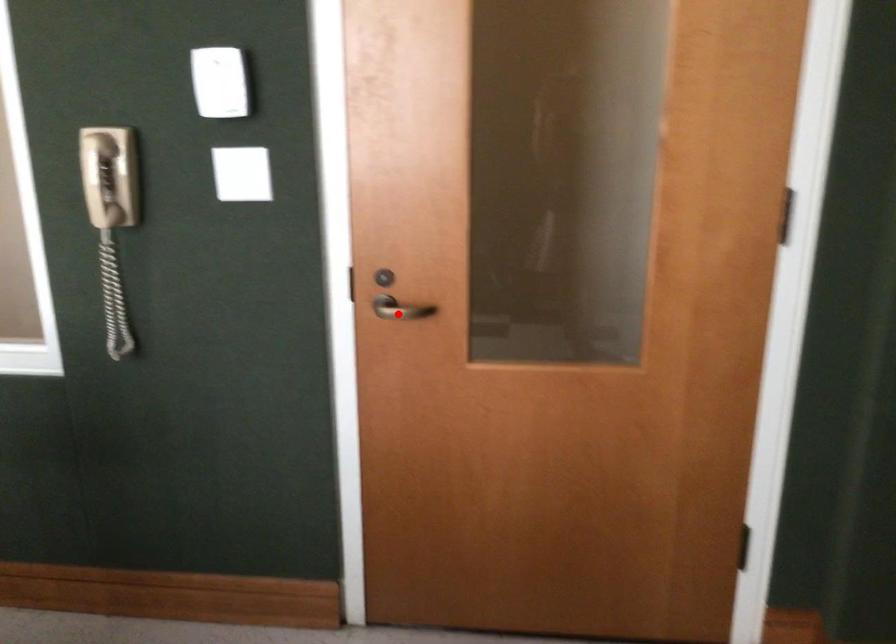
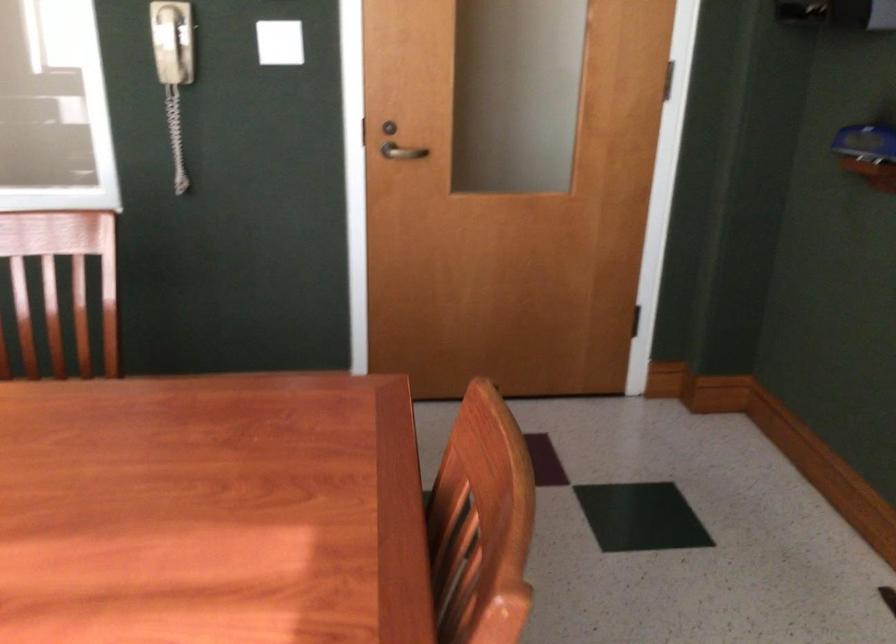
In the second image, find the point that corresponds to the highlighted location in the first image.

(401, 152)